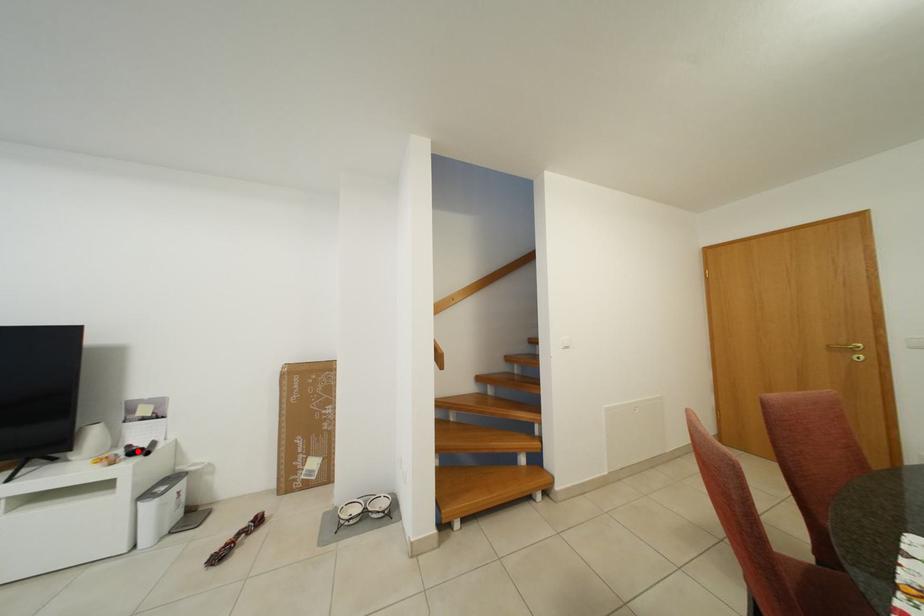
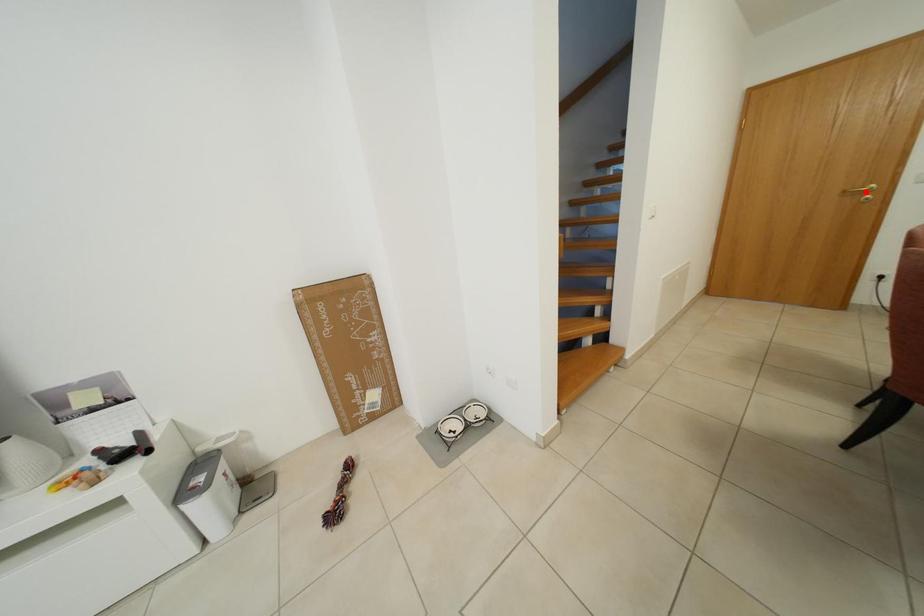
Based on the photo, I am providing you with two images of the same scene from different viewpoints. A red point is marked on the first image and another point is marked on the second image. Is the red point in image1 aligned with the point shown in image2?

No